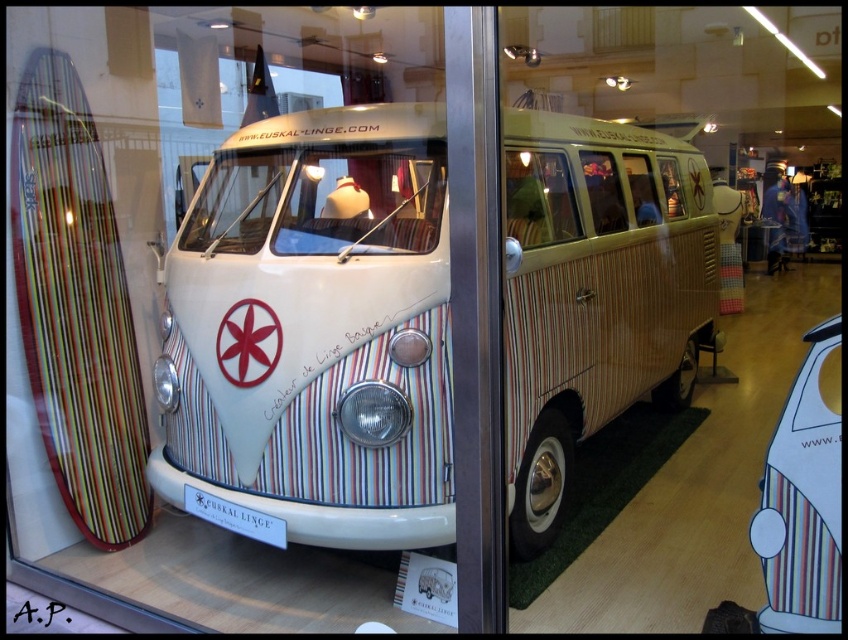
Question: Is white striped van at center bigger than striped fabric van at center?

Choices:
 (A) no
 (B) yes

Answer: (B)

Question: Does multicolored striped surfboard at left have a smaller size compared to striped fabric van at center?

Choices:
 (A) no
 (B) yes

Answer: (A)

Question: Does multicolored striped surfboard at left have a lesser width compared to striped fabric van at center?

Choices:
 (A) yes
 (B) no

Answer: (B)

Question: Which is farther from the multicolored striped surfboard at left?

Choices:
 (A) striped fabric van at center
 (B) white striped van at center

Answer: (A)

Question: Which point is closer to the camera?

Choices:
 (A) white striped van at center
 (B) multicolored striped surfboard at left
 (C) striped fabric van at center

Answer: (C)

Question: Which object appears farthest from the camera in this image?

Choices:
 (A) striped fabric van at center
 (B) multicolored striped surfboard at left

Answer: (B)